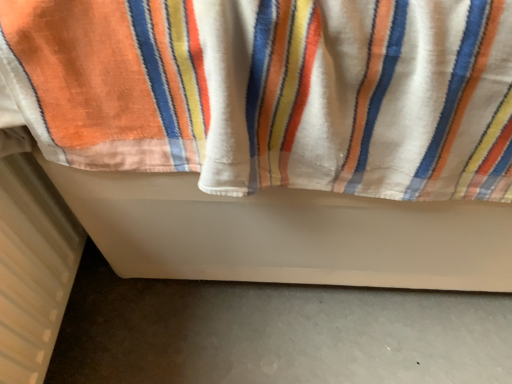
What do you see at coordinates (368, 100) in the screenshot? I see `white soft towel at center` at bounding box center [368, 100].

Identify the location of white soft towel at center. The height and width of the screenshot is (384, 512). (368, 100).

Locate an element on the screen. white textured radiator at lower left is located at coordinates (33, 267).

Describe the element at coordinates (33, 267) in the screenshot. I see `white textured radiator at lower left` at that location.

This screenshot has width=512, height=384. In order to click on white soft towel at center in this screenshot , I will do `click(368, 100)`.

Is white soft towel at center at the left side of white textured radiator at lower left?

In fact, white soft towel at center is to the right of white textured radiator at lower left.

Who is more distant, white soft towel at center or white textured radiator at lower left?

white textured radiator at lower left is further away from the camera.

Considering the positions of point (313, 127) and point (48, 315), is point (313, 127) closer or farther from the camera than point (48, 315)?

Point (313, 127).

From the image's perspective, which is above, white soft towel at center or white textured radiator at lower left?

white soft towel at center is shown above in the image.

From a real-world perspective, which is physically above, white soft towel at center or white textured radiator at lower left?

white soft towel at center.

Considering the sizes of white soft towel at center and white textured radiator at lower left in the image, is white soft towel at center wider or thinner than white textured radiator at lower left?

Clearly, white soft towel at center has more width compared to white textured radiator at lower left.

Who is taller, white soft towel at center or white textured radiator at lower left?

Standing taller between the two is white soft towel at center.

Looking at the image, does white soft towel at center seem bigger or smaller compared to white textured radiator at lower left?

A: Clearly, white soft towel at center is larger in size than white textured radiator at lower left.

Is white soft towel at center situated inside white textured radiator at lower left or outside?

white soft towel at center is spatially situated outside white textured radiator at lower left.

Is white soft towel at center with white textured radiator at lower left?

white soft towel at center is not next to white textured radiator at lower left, and they're not touching.

Is white soft towel at center oriented towards white textured radiator at lower left?

Yes, white soft towel at center is turned towards white textured radiator at lower left.

How different are the orientations of white soft towel at center and white textured radiator at lower left in degrees?

They differ by 89.4 degrees in their facing directions.

Consider the image. How far apart are white soft towel at center and white textured radiator at lower left?

They are 13.69 inches apart.

You are a GUI agent. You are given a task and a screenshot of the screen. Output one action in this format:
    pyautogui.click(x=<x>, y=<y>)
    Task: Click on the towel that is in front of the white textured radiator at lower left
    This screenshot has height=384, width=512.
    Given the screenshot: What is the action you would take?
    pyautogui.click(x=368, y=100)

Considering the positions of objects white textured radiator at lower left and white soft towel at center in the image provided, who is more to the right, white textured radiator at lower left or white soft towel at center?

From the viewer's perspective, white soft towel at center appears more on the right side.

Between white textured radiator at lower left and white soft towel at center, which one is positioned in front?

white soft towel at center is more forward.

Between point (45, 246) and point (281, 46), which one is positioned behind?

The point (45, 246) is more distant.

From the image's perspective, is white textured radiator at lower left on white soft towel at center?

No, from the image's perspective, white textured radiator at lower left is not on top of white soft towel at center.

From a real-world perspective, which is physically above, white textured radiator at lower left or white soft towel at center?

white soft towel at center.

Which object is wider, white textured radiator at lower left or white soft towel at center?

white soft towel at center.

Considering the sizes of objects white textured radiator at lower left and white soft towel at center in the image provided, who is shorter, white textured radiator at lower left or white soft towel at center?

With less height is white textured radiator at lower left.

Considering the relative sizes of white textured radiator at lower left and white soft towel at center in the image provided, is white textured radiator at lower left bigger than white soft towel at center?

No.

From the picture: Would you say white textured radiator at lower left is inside or outside white soft towel at center?

white textured radiator at lower left is spatially positioned inside white soft towel at center.

Can you see white textured radiator at lower left touching white soft towel at center?

No, white textured radiator at lower left is not next to white soft towel at center.

Could you tell me if white textured radiator at lower left is facing white soft towel at center?

Yes, white textured radiator at lower left faces towards white soft towel at center.

Can you tell me how much white textured radiator at lower left and white soft towel at center differ in facing direction?

white textured radiator at lower left and white soft towel at center are facing 89.4 degrees away from each other.

Measure the distance from white textured radiator at lower left to white soft towel at center.

A distance of 13.69 inches exists between white textured radiator at lower left and white soft towel at center.

Locate an element on the screen. This screenshot has height=384, width=512. radiator that is below the white soft towel at center (from the image's perspective) is located at coordinates (33, 267).

Where is `towel that appears on the right of white textured radiator at lower left`? The image size is (512, 384). towel that appears on the right of white textured radiator at lower left is located at coordinates (368, 100).

Identify the location of radiator below the white soft towel at center (from the image's perspective). This screenshot has width=512, height=384. (33, 267).